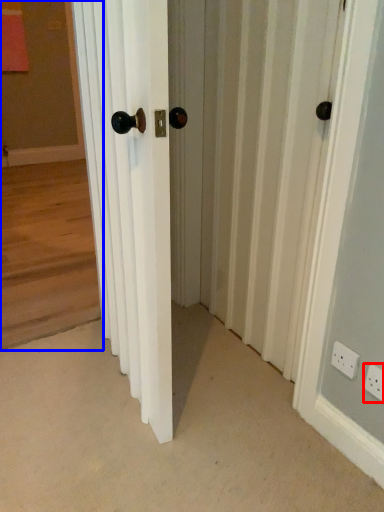
Question: Which point is further to the camera, electric outlet (highlighted by a red box) or corridor (highlighted by a blue box)?

Choices:
 (A) electric outlet
 (B) corridor

Answer: (B)